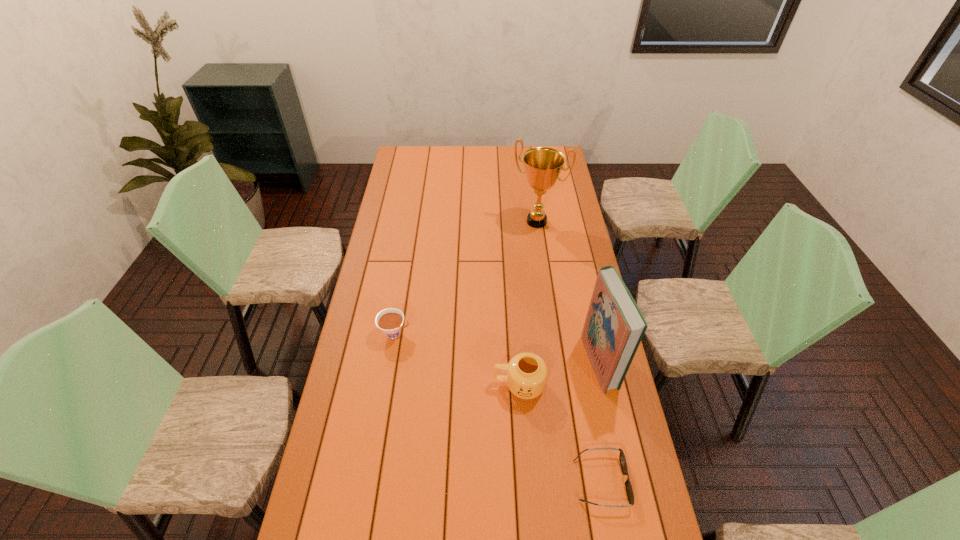
Locate an element on the screen. empty space that is in between the award and the hardback book is located at coordinates (568, 292).

This screenshot has height=540, width=960. Find the location of `vacant area that lies between the third tallest object and the farthest object`. vacant area that lies between the third tallest object and the farthest object is located at coordinates (528, 303).

Find the location of a particular element. Image resolution: width=960 pixels, height=540 pixels. empty location between the second tallest object and the farthest object is located at coordinates (568, 292).

What are the coordinates of `vacant area that lies between the second shortest object and the second tallest object` in the screenshot? It's located at (497, 347).

Locate an element on the screen. This screenshot has height=540, width=960. empty location between the award and the teacup is located at coordinates (466, 278).

Identify the location of vacant area that lies between the mug and the award. (528, 303).

This screenshot has height=540, width=960. What are the coordinates of `vacant area that lies between the third tallest object and the farthest object` in the screenshot? It's located at (528, 303).

The height and width of the screenshot is (540, 960). Identify the location of unoccupied area between the award and the second shortest object. (466, 278).

The width and height of the screenshot is (960, 540). What are the coordinates of `unoccupied area between the third tallest object and the fourth tallest object` in the screenshot? It's located at (457, 360).

Point out which object is positioned as the fourth nearest to the leftmost object. Please provide its 2D coordinates. Your answer should be formatted as a tuple, i.e. [(x, y)], where the tuple contains the x and y coordinates of a point satisfying the conditions above.

[(629, 490)]